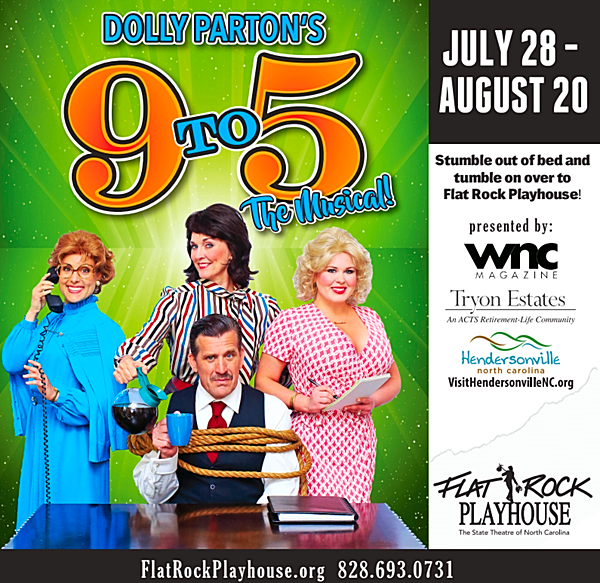
Image resolution: width=600 pixels, height=583 pixels. What are the coordinates of `steno pad on center right` in the screenshot? It's located at (370, 375).